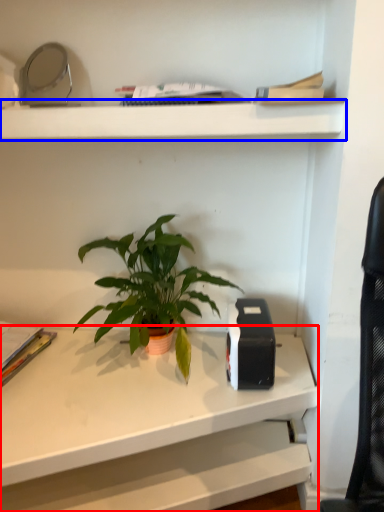
Question: Which object is closer to the camera taking this photo, desk (highlighted by a red box) or shelf (highlighted by a blue box)?

Choices:
 (A) desk
 (B) shelf

Answer: (A)